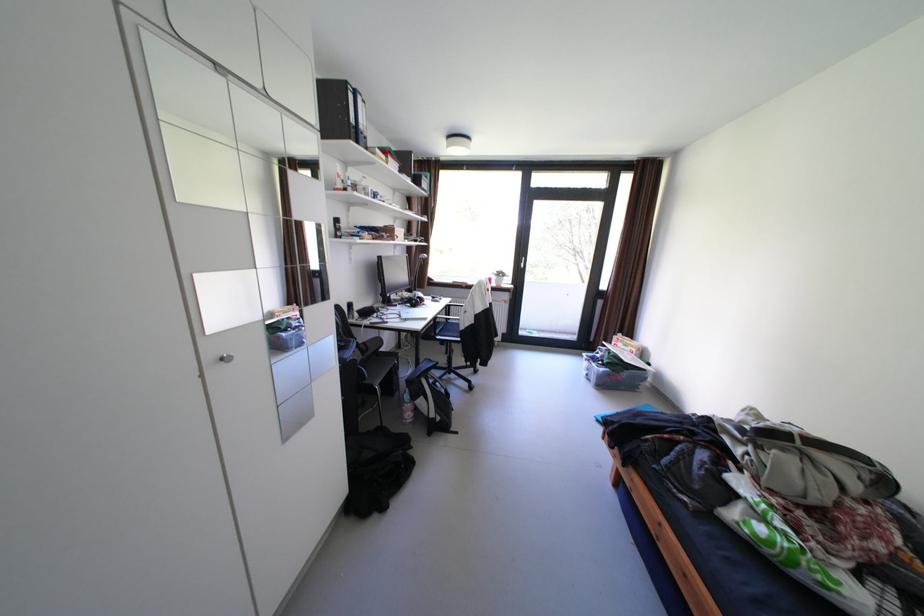
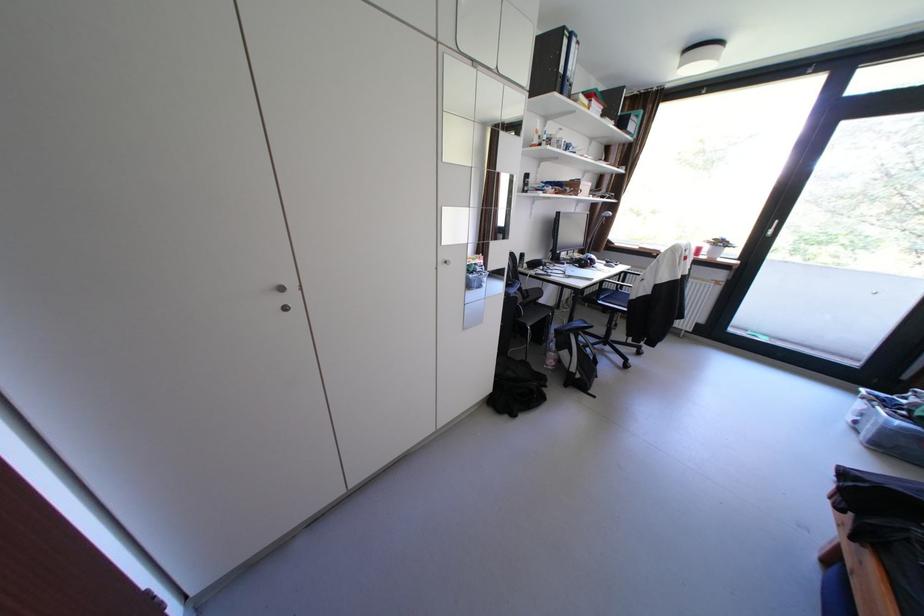
Locate, in the second image, the point that corresponds to point (448, 331) in the first image.

(613, 297)